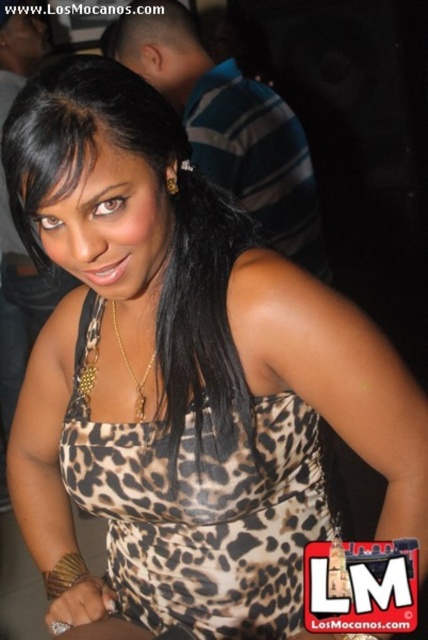
Can you confirm if leopard print dress at center is smaller than gold chain at center?

No.

Is the position of leopard print dress at center less distant than that of gold chain at center?

Yes, leopard print dress at center is in front of gold chain at center.

In the scene shown: Measure the distance between point (247, 419) and camera.

Point (247, 419) and camera are 31.57 inches apart from each other.

Where is `leopard print dress at center`? The height and width of the screenshot is (640, 428). leopard print dress at center is located at coordinates (169, 209).

Can you confirm if leopard print fabric dress at center is shorter than gold chain at center?

No, leopard print fabric dress at center is not shorter than gold chain at center.

Locate an element on the screen. This screenshot has width=428, height=640. leopard print fabric dress at center is located at coordinates (201, 508).

Between point (133, 486) and point (48, 76), which one is positioned behind?

The point (133, 486) is behind.

Where is `leopard print fabric dress at center`? Image resolution: width=428 pixels, height=640 pixels. leopard print fabric dress at center is located at coordinates (201, 508).